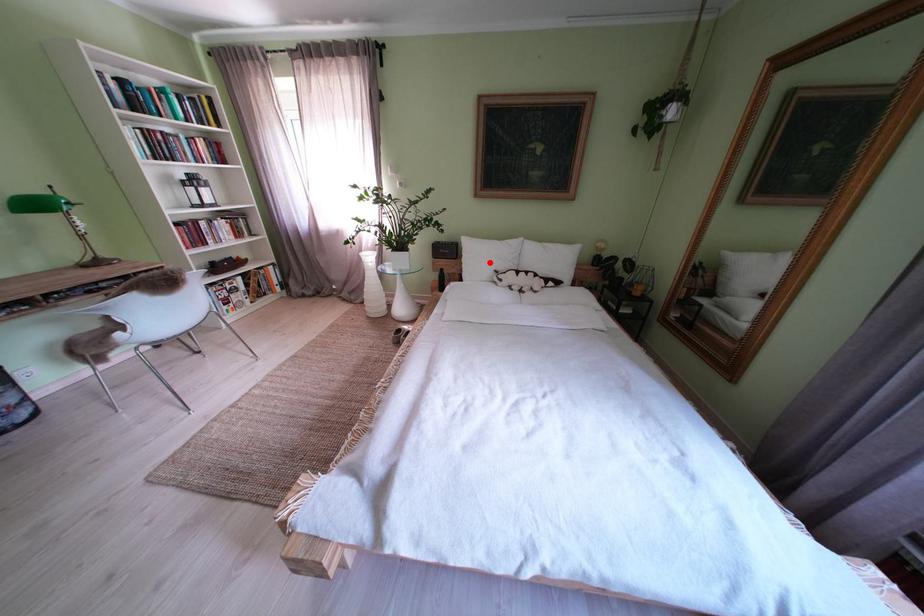
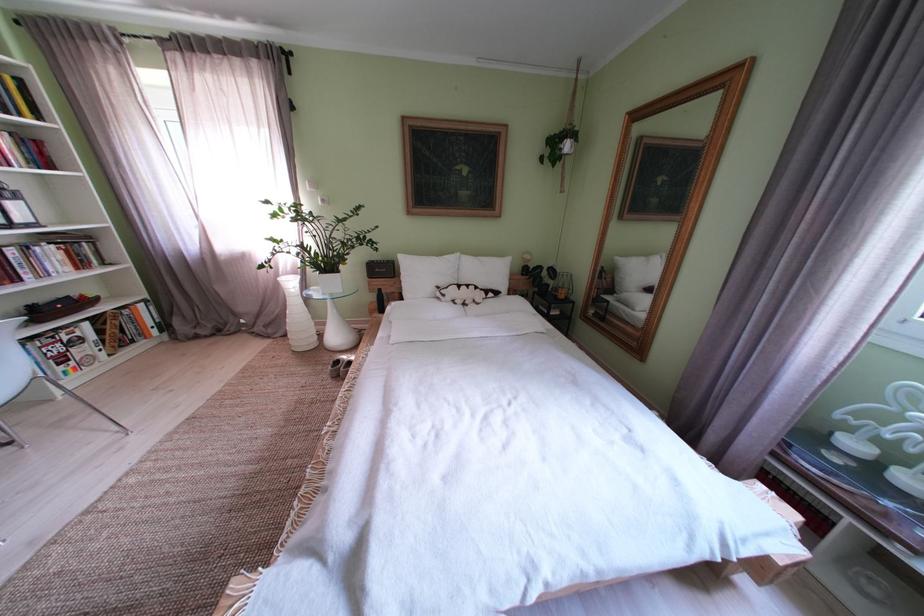
Locate, in the second image, the point that corresponds to the highlighted location in the first image.

(429, 280)